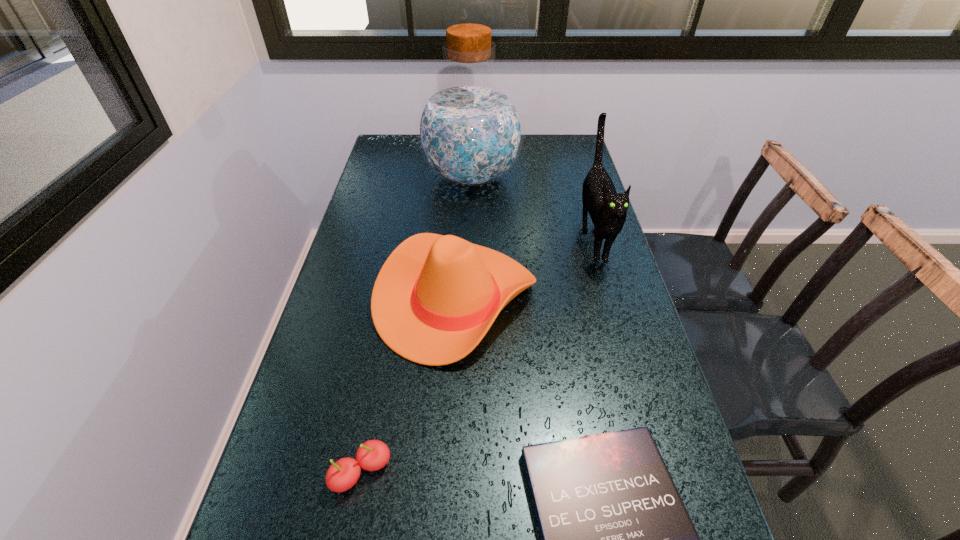
The height and width of the screenshot is (540, 960). In order to click on the farthest object in this screenshot , I will do `click(470, 131)`.

What are the coordinates of `the tallest object` in the screenshot? It's located at (470, 131).

Where is `the second tallest object`? The width and height of the screenshot is (960, 540). the second tallest object is located at coordinates (607, 209).

You are a GUI agent. You are given a task and a screenshot of the screen. Output one action in this format:
    pyautogui.click(x=<x>, y=<y>)
    Task: Click on the third shortest object
    The image size is (960, 540).
    Given the screenshot: What is the action you would take?
    pyautogui.click(x=435, y=298)

The width and height of the screenshot is (960, 540). What are the coordinates of `the second shortest object` in the screenshot? It's located at (372, 455).

Where is `vacant area situated on the front of the tallest object`? vacant area situated on the front of the tallest object is located at coordinates (468, 272).

In order to click on vacant space positioned 0.080m on the face of the cat in this screenshot , I will do `click(611, 299)`.

Where is `vacant space located on the right of the third tallest object`? vacant space located on the right of the third tallest object is located at coordinates (560, 300).

You are a GUI agent. You are given a task and a screenshot of the screen. Output one action in this format:
    pyautogui.click(x=<x>, y=<y>)
    Task: Click on the vacant space located 0.060m on the front of the cherry
    
    Given the screenshot: What is the action you would take?
    pyautogui.click(x=349, y=536)

Identify the location of object situated at the far edge. (470, 131).